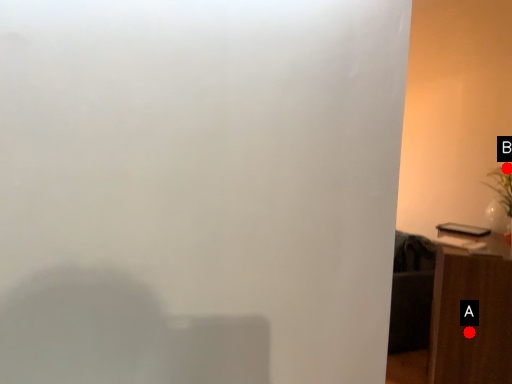
Question: Two points are circled on the image, labeled by A and B beside each circle. Which point is closer to the camera?

Choices:
 (A) A is closer
 (B) B is closer

Answer: (A)